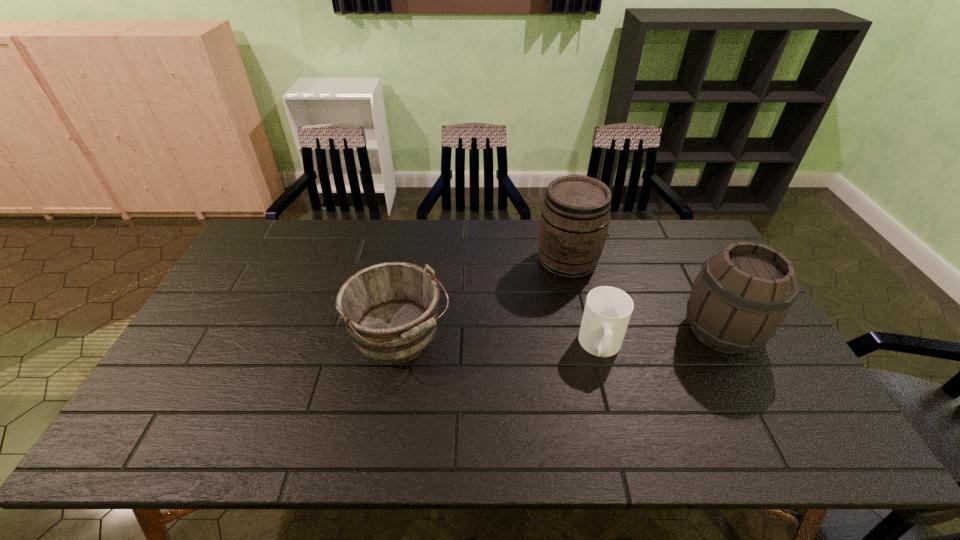
Locate an element on the screen. The height and width of the screenshot is (540, 960). wine bucket that is the third closest to the mug is located at coordinates pyautogui.click(x=390, y=310).